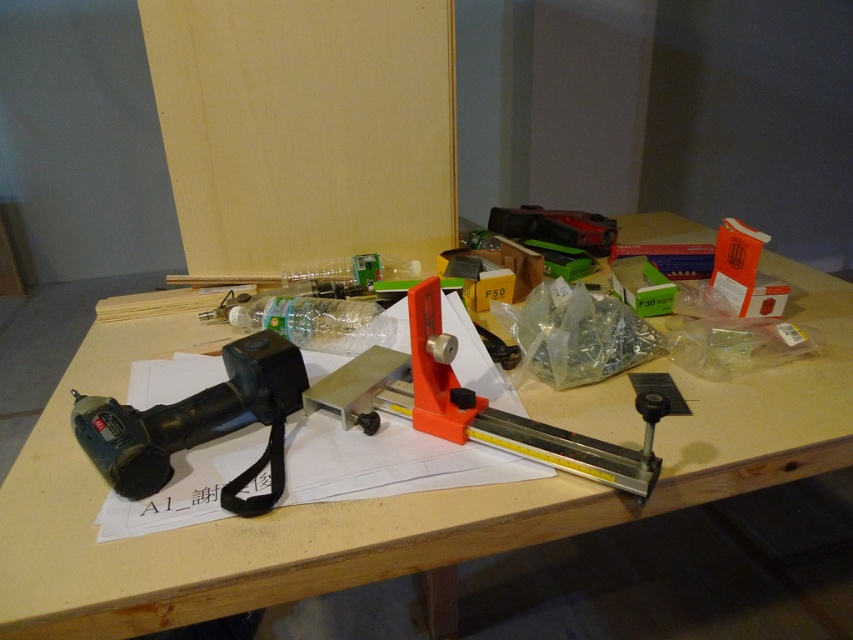
At what (x,y) coordinates should I click in order to perform the action: click on wooden table at center. Please return your answer as a coordinate pair (x, y). Looking at the image, I should click on (386, 497).

Which is more to the right, wooden table at center or orange plastic ruler at center?

From the viewer's perspective, wooden table at center appears more on the right side.

Is point (273, 576) in front of point (413, 300)?

Yes, it is in front of point (413, 300).

Where is `wooden table at center`? The height and width of the screenshot is (640, 853). wooden table at center is located at coordinates (386, 497).

Can you confirm if wooden table at center is positioned to the right of black plastic drill at left?

Correct, you'll find wooden table at center to the right of black plastic drill at left.

Measure the distance from wooden table at center to black plastic drill at left.

A distance of 23.82 centimeters exists between wooden table at center and black plastic drill at left.

Between point (843, 356) and point (105, 403), which one is positioned in front?

Point (105, 403) is in front.

Identify the location of wooden table at center. The width and height of the screenshot is (853, 640). (386, 497).

You are a GUI agent. You are given a task and a screenshot of the screen. Output one action in this format:
    pyautogui.click(x=<x>, y=<y>)
    Task: Click on the orange plastic ruler at center
    This screenshot has height=640, width=853.
    Given the screenshot: What is the action you would take?
    pyautogui.click(x=473, y=404)

Which is in front, point (366, 401) or point (202, 406)?

Point (202, 406) is more forward.

Who is more distant from viewer, [434,301] or [90,458]?

Point [434,301]

What are the coordinates of `orange plastic ruler at center` in the screenshot? It's located at (473, 404).